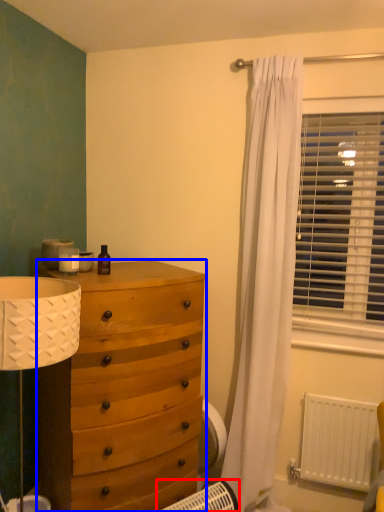
Question: Which of the following is the farthest to the observer, heater (highlighted by a red box) or chest of drawers (highlighted by a blue box)?

Choices:
 (A) heater
 (B) chest of drawers

Answer: (B)